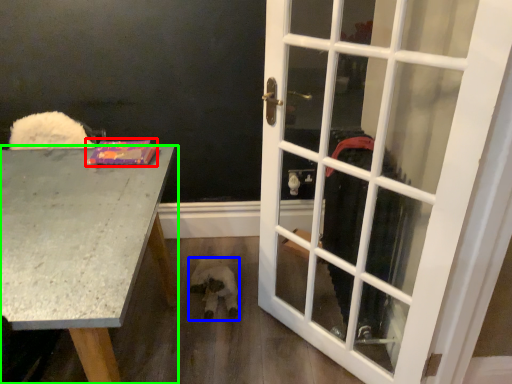
Question: Which is farther away from book (highlighted by a red box)? animal (highlighted by a blue box) or desk (highlighted by a green box)?

Choices:
 (A) animal
 (B) desk

Answer: (A)